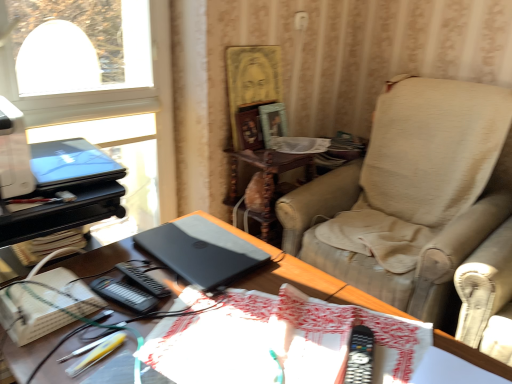
Where is `empty space that is in between matte black laptop at center, which is counted as the first laptop, starting from the right, and black plastic remote control at lower right`? The width and height of the screenshot is (512, 384). empty space that is in between matte black laptop at center, which is counted as the first laptop, starting from the right, and black plastic remote control at lower right is located at coordinates (275, 311).